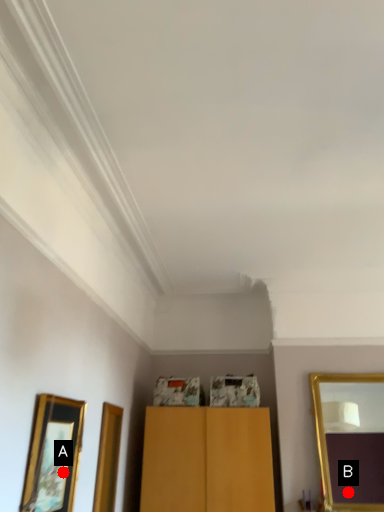
Question: Two points are circled on the image, labeled by A and B beside each circle. Which point is farther from the camera taking this photo?

Choices:
 (A) A is further
 (B) B is further

Answer: (B)